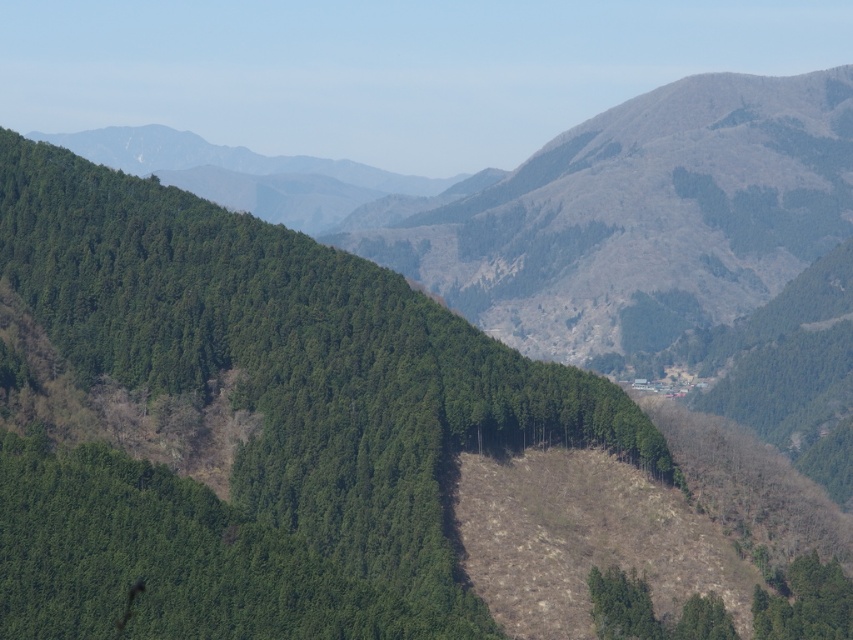
You are a hiker planning to set up a tent. You have two options for the campsite location near the green textured forest at center and the green matte tree at lower right. Which location would provide better protection from strong winds? Please explain your reasoning based on the scene description.

The green textured forest at center would provide better protection from strong winds because it has a greater height compared to the green matte tree at lower right, creating a more substantial barrier against wind.

You are an aerial surveyor analyzing the mountainous landscape. You need to identify the exact 2D coordinates of the green textured forest at center for a map overlay. What are its coordinates?

The green textured forest at center is located at the 2D coordinates point (263, 420).

You are hiking and want to reach the green matte tree at lower right from the green textured forest at center. Which direction should you head to descend?

The green textured forest at center is above the green matte tree at lower right, so you should head downward from the green textured forest at center to reach the green matte tree at lower right.